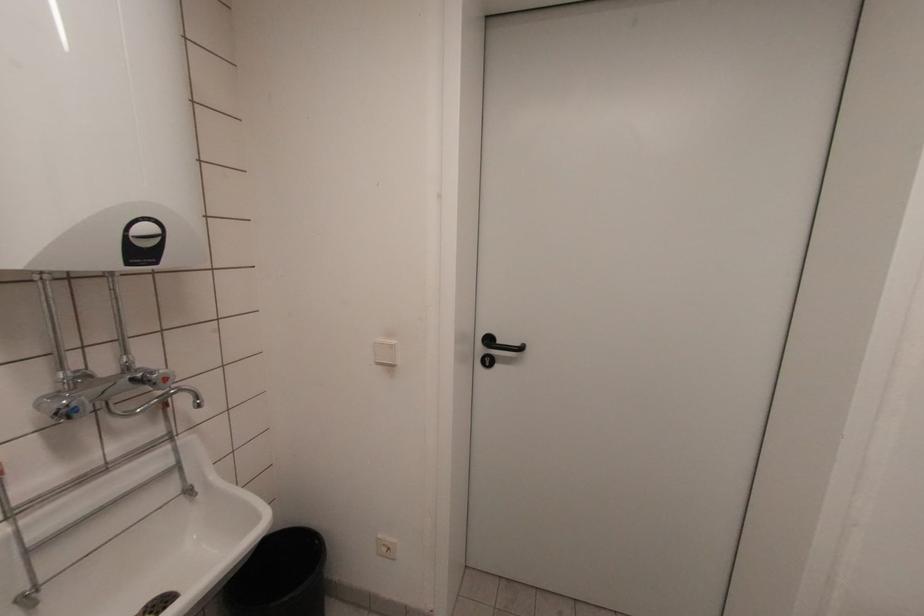
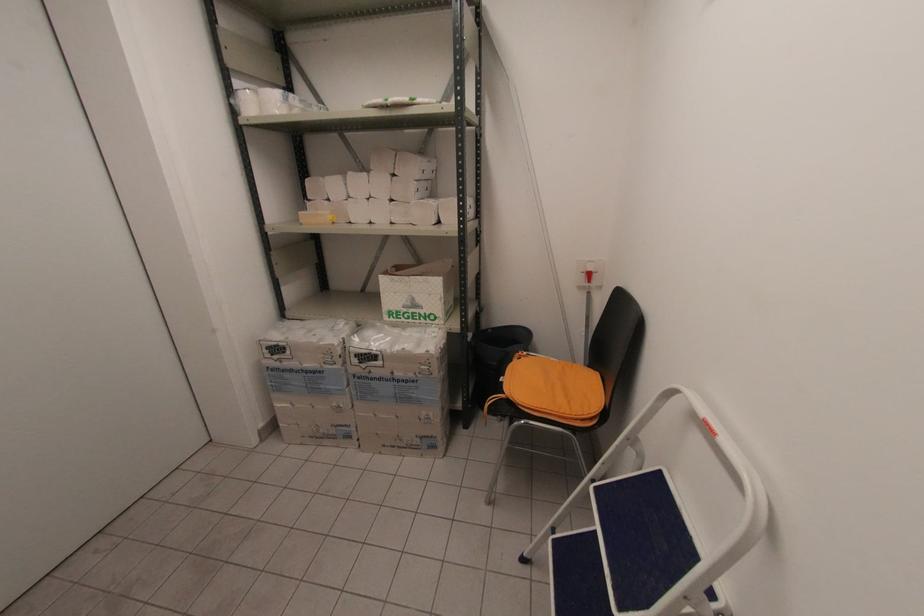
First-person continuous shooting, in which direction is the camera rotating?

The rotation direction of the camera is right-down.